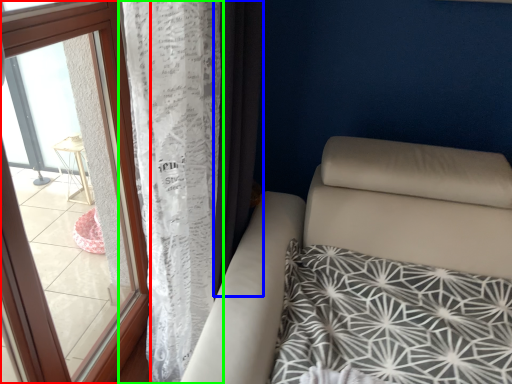
Question: Which is nearer to the window (highlighted by a red box)? curtain (highlighted by a blue box) or curtain (highlighted by a green box).

Choices:
 (A) curtain
 (B) curtain

Answer: (B)